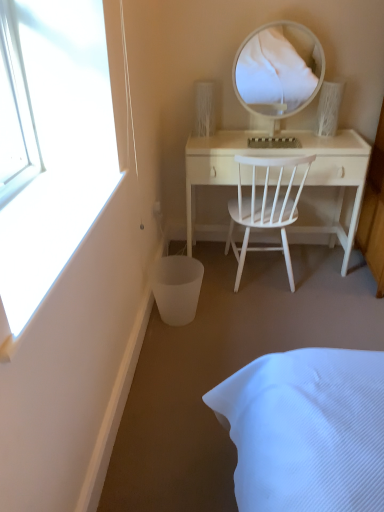
This screenshot has width=384, height=512. I want to click on vacant region above white matte trash bin/can at lower left (from a real-world perspective), so click(x=182, y=270).